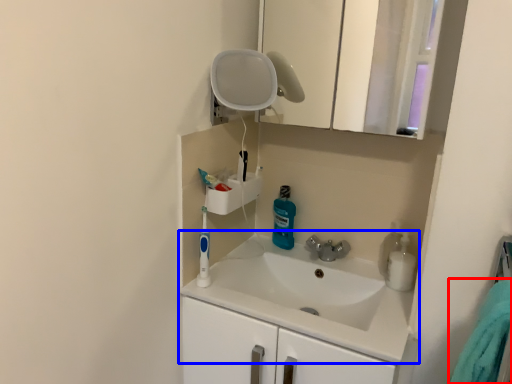
Question: Which object is further to the camera taking this photo, bath towel (highlighted by a red box) or sink (highlighted by a blue box)?

Choices:
 (A) bath towel
 (B) sink

Answer: (B)